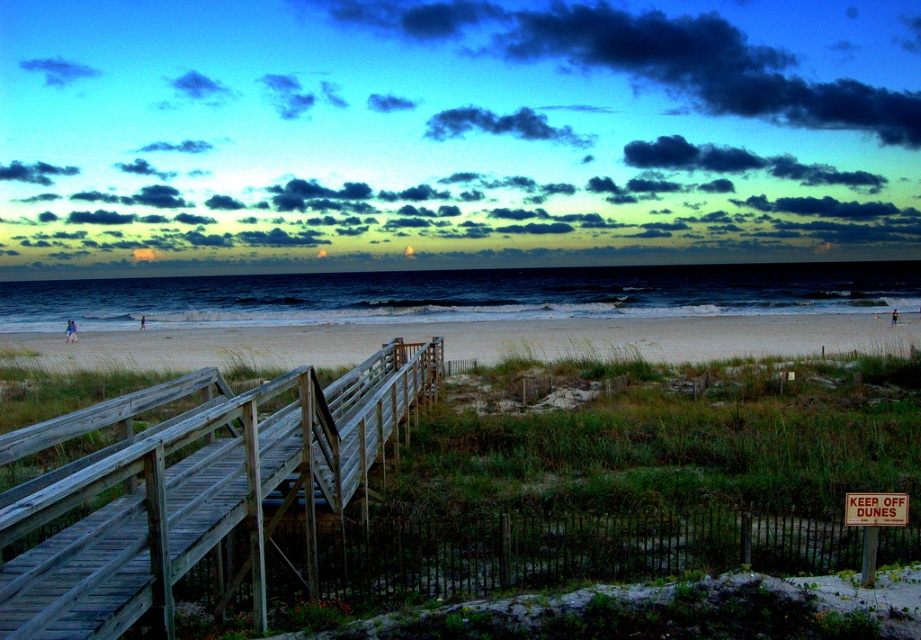
Question: Is wooden rail at center further to the viewer compared to white sand at center?

Choices:
 (A) yes
 (B) no

Answer: (B)

Question: Which object appears farthest from the camera in this image?

Choices:
 (A) white sand at center
 (B) wooden rail at center

Answer: (A)

Question: Can you confirm if wooden rail at center is bigger than white sand at center?

Choices:
 (A) yes
 (B) no

Answer: (B)

Question: Does wooden rail at center have a greater width compared to white sand at center?

Choices:
 (A) yes
 (B) no

Answer: (B)